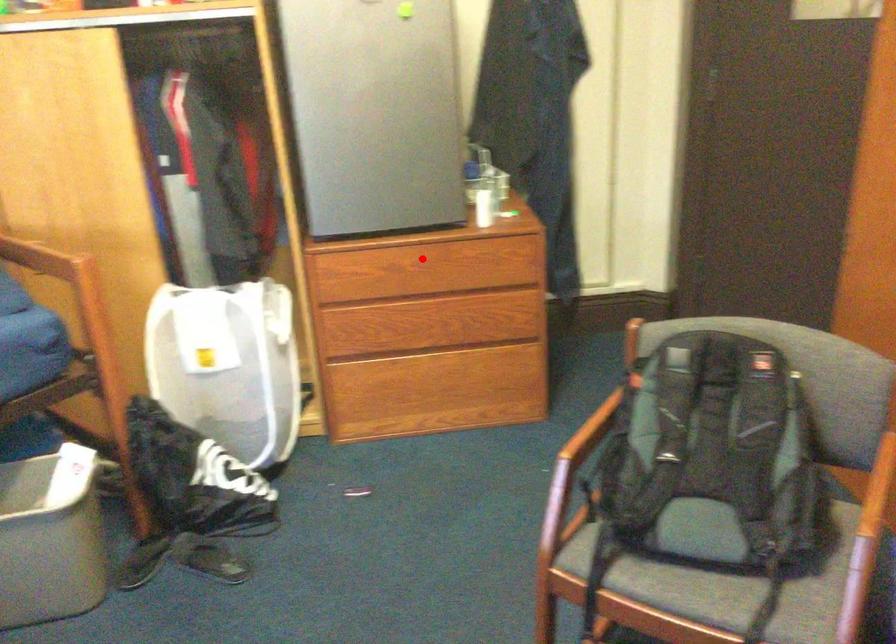
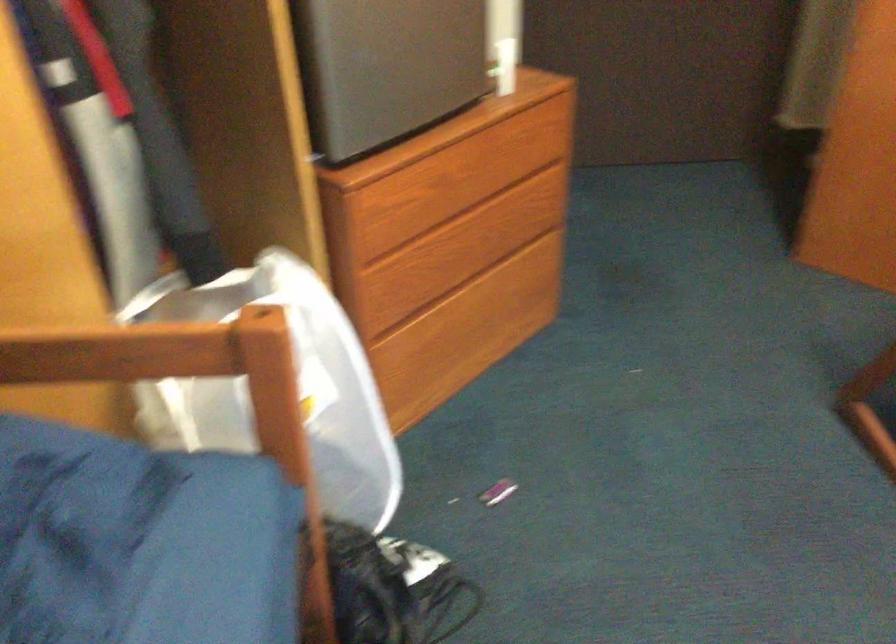
Find the pixel in the second image that matches the highlighted location in the first image.

(462, 152)